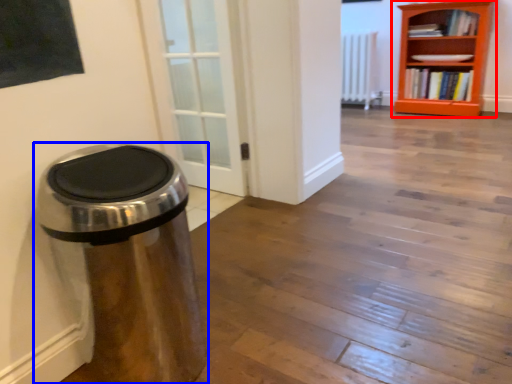
Question: Which of the following is the closest to the observer, bookcase (highlighted by a red box) or waste container (highlighted by a blue box)?

Choices:
 (A) bookcase
 (B) waste container

Answer: (B)